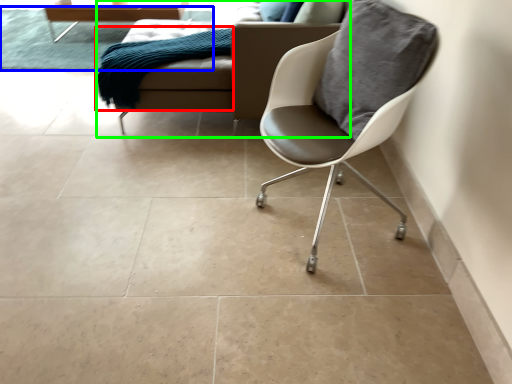
Question: Which object is positioned farthest from material (highlighted by a red box)? Select from mat (highlighted by a blue box) and studio couch (highlighted by a green box).

Choices:
 (A) mat
 (B) studio couch

Answer: (A)